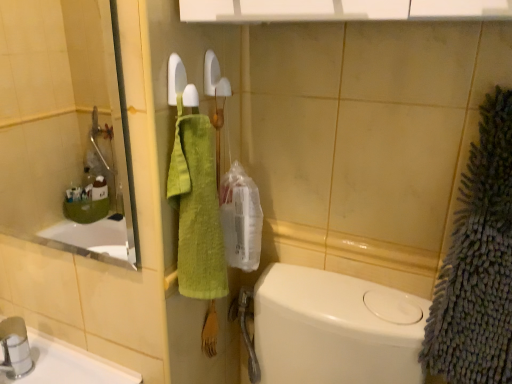
Question: Considering the relative positions of clear glass mirror at upper left and gray fuzzy bath towel at right, arranged as the first bath towel when viewed from the right, in the image provided, is clear glass mirror at upper left in front of gray fuzzy bath towel at right, arranged as the first bath towel when viewed from the right,?

Choices:
 (A) no
 (B) yes

Answer: (A)

Question: Can you confirm if clear glass mirror at upper left is smaller than gray fuzzy bath towel at right, which is counted as the 2th bath towel, starting from the left?

Choices:
 (A) yes
 (B) no

Answer: (A)

Question: Is clear glass mirror at upper left touching gray fuzzy bath towel at right, which is counted as the 2th bath towel, starting from the left?

Choices:
 (A) yes
 (B) no

Answer: (B)

Question: From a real-world perspective, is clear glass mirror at upper left physically below gray fuzzy bath towel at right, which is counted as the 2th bath towel, starting from the left?

Choices:
 (A) yes
 (B) no

Answer: (B)

Question: Is gray fuzzy bath towel at right, arranged as the first bath towel when viewed from the right, a part of clear glass mirror at upper left?

Choices:
 (A) no
 (B) yes

Answer: (A)

Question: Is gray fuzzy bath towel at right, which is counted as the 2th bath towel, starting from the left, inside or outside of green cotton towel at center, which appears as the 2th bath towel when viewed from the right?

Choices:
 (A) inside
 (B) outside

Answer: (B)

Question: From the image's perspective, is gray fuzzy bath towel at right, arranged as the first bath towel when viewed from the right, located above or below green cotton towel at center, the 1th bath towel in the left-to-right sequence?

Choices:
 (A) above
 (B) below

Answer: (B)

Question: In the image, is gray fuzzy bath towel at right, arranged as the first bath towel when viewed from the right, positioned in front of or behind green cotton towel at center, which appears as the 2th bath towel when viewed from the right?

Choices:
 (A) behind
 (B) front

Answer: (B)

Question: Considering the positions of gray fuzzy bath towel at right, which is counted as the 2th bath towel, starting from the left, and green cotton towel at center, which appears as the 2th bath towel when viewed from the right, in the image, is gray fuzzy bath towel at right, which is counted as the 2th bath towel, starting from the left, bigger or smaller than green cotton towel at center, which appears as the 2th bath towel when viewed from the right,?

Choices:
 (A) big
 (B) small

Answer: (A)

Question: Considering the relative positions of gray fuzzy bath towel at right, arranged as the first bath towel when viewed from the right, and clear glass mirror at upper left in the image provided, is gray fuzzy bath towel at right, arranged as the first bath towel when viewed from the right, to the left or to the right of clear glass mirror at upper left?

Choices:
 (A) right
 (B) left

Answer: (A)

Question: In terms of width, does gray fuzzy bath towel at right, arranged as the first bath towel when viewed from the right, look wider or thinner when compared to clear glass mirror at upper left?

Choices:
 (A) thin
 (B) wide

Answer: (B)

Question: In terms of size, does gray fuzzy bath towel at right, which is counted as the 2th bath towel, starting from the left, appear bigger or smaller than clear glass mirror at upper left?

Choices:
 (A) small
 (B) big

Answer: (B)

Question: From the image's perspective, is gray fuzzy bath towel at right, which is counted as the 2th bath towel, starting from the left, located above or below clear glass mirror at upper left?

Choices:
 (A) below
 (B) above

Answer: (A)

Question: From a real-world perspective, is green cotton towel at center, which appears as the 2th bath towel when viewed from the right, above or below clear glass mirror at upper left?

Choices:
 (A) above
 (B) below

Answer: (B)

Question: Is green cotton towel at center, the 1th bath towel in the left-to-right sequence, taller or shorter than clear glass mirror at upper left?

Choices:
 (A) short
 (B) tall

Answer: (B)